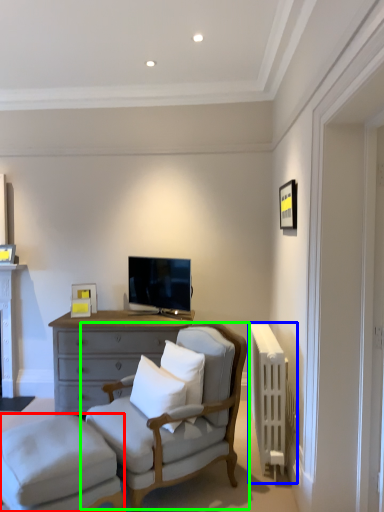
Question: Which object is positioned farthest from stool (highlighted by a red box)? Select from radiator (highlighted by a blue box) and chair (highlighted by a green box).

Choices:
 (A) radiator
 (B) chair

Answer: (A)